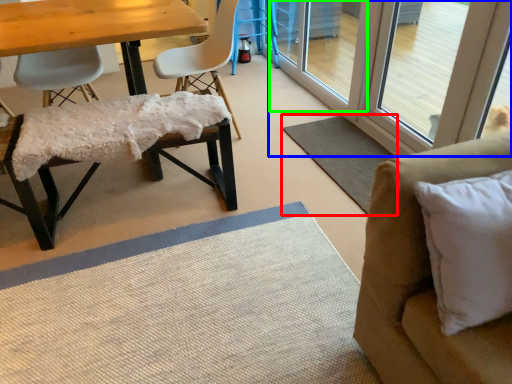
Question: Which object is the farthest from mat (highlighted by a red box)? Choose among these: screen door (highlighted by a blue box) or screen door (highlighted by a green box).

Choices:
 (A) screen door
 (B) screen door

Answer: (B)